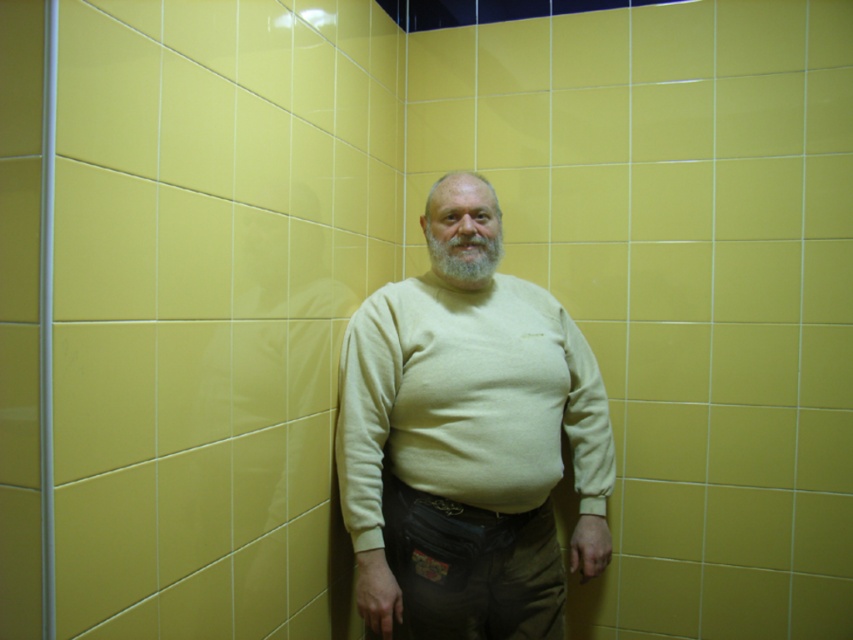
You are an observer looking at the man in the image. Which object is positioned lower on his body between the beige cotton sweater at center and the gray matte beard at center?

The beige cotton sweater at center is located below the gray matte beard at center, so the sweater is positioned lower on his body.

You are an artist trying to sketch the man in the image. You need to decide which object to outline first based on their sizes. Since the beige cotton sweater at center is wider than the gray matte beard at center, which one should you start with to ensure proper proportions?

The beige cotton sweater at center is wider than the gray matte beard at center, so you should outline the beige cotton sweater at center first to establish the correct proportions before detailing the smaller features like the beard.